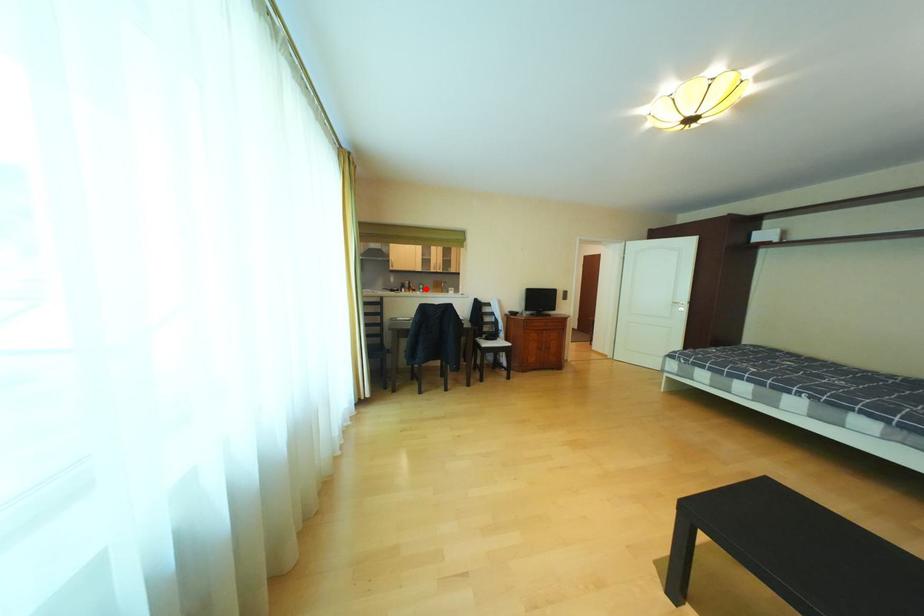
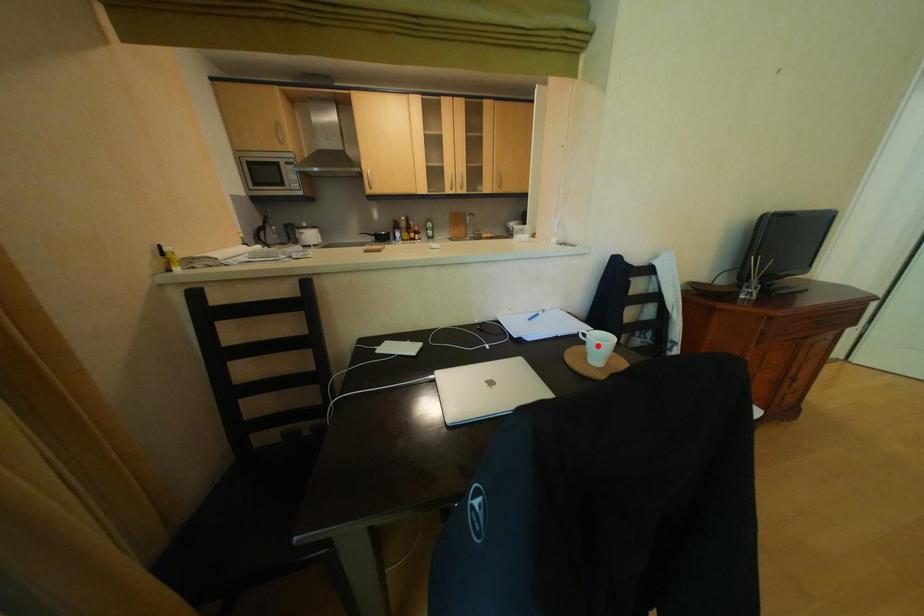
I am providing you with two images of the same scene from different viewpoints. A red point is marked on the first image and another point is marked on the second image. Do the highlighted points in image1 and image2 indicate the same real-world spot?

No